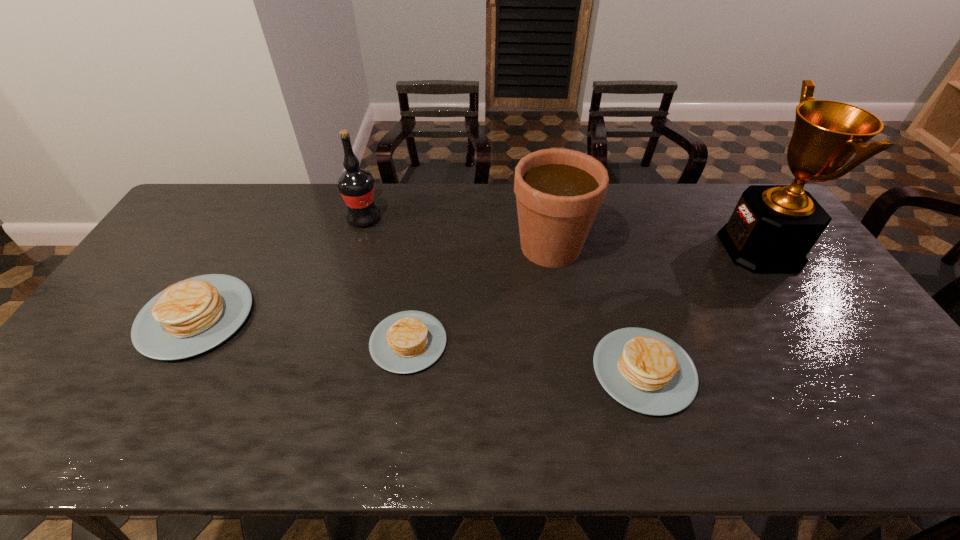
In the current image, all pancakes are evenly spaced. To maintain this equal spacing, where should an additional pancake be placed on the right? Please point out a free spot. Please provide its 2D coordinates. Your answer should be formatted as a tuple, i.e. [(x, y)], where the tuple contains the x and y coordinates of a point satisfying the conditions above.

[(905, 402)]